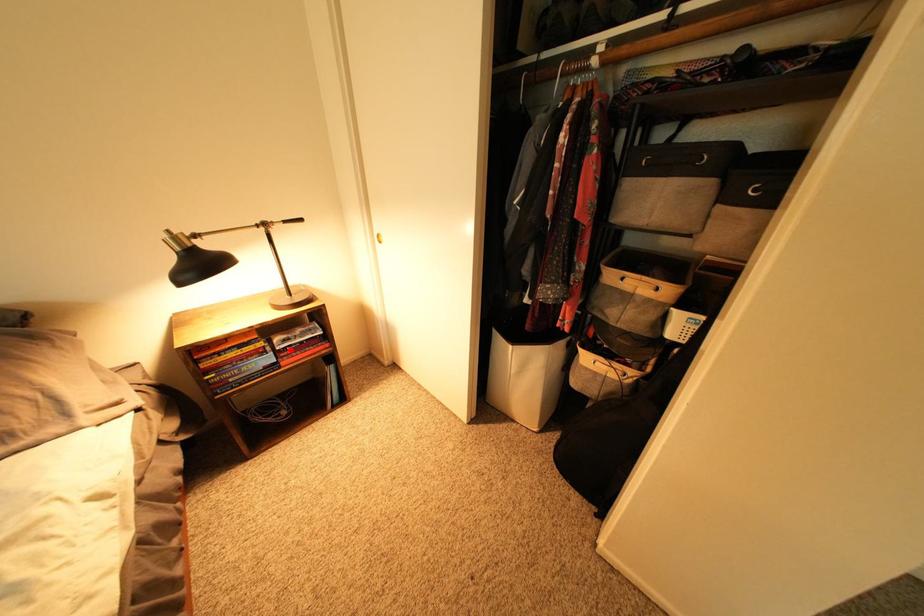
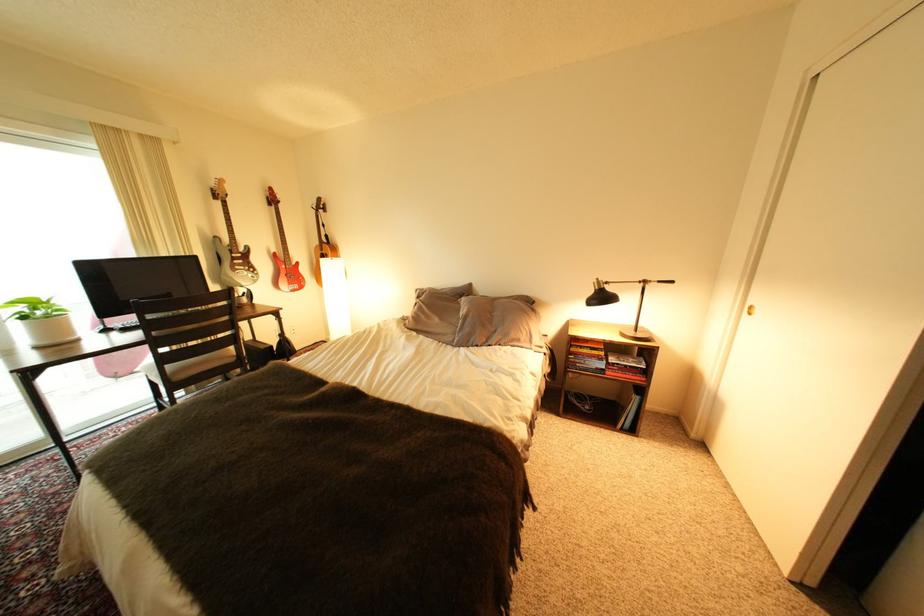
Locate, in the second image, the point that corresponds to the highlighted location in the first image.

(623, 363)